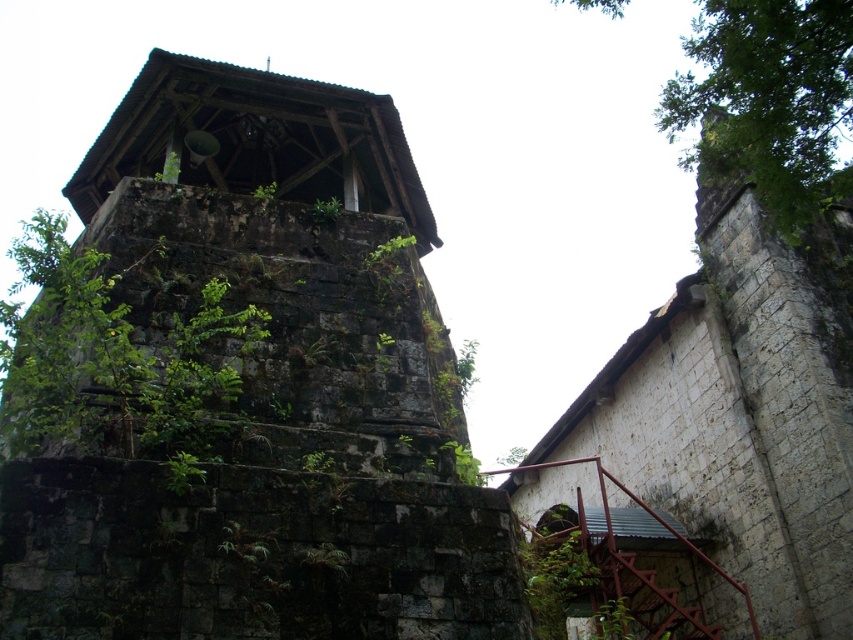
You are a maintenance worker needing to inspect the green leafy tree at upper right from the dark stone tower at center. Given that your ladder can extend up to 30 meters, will you be able to reach the tree from the tower?

The dark stone tower at center and green leafy tree at upper right are 29.34 meters apart, so yes, the ladder can reach the tree since it is within the 30 meters extension limit.